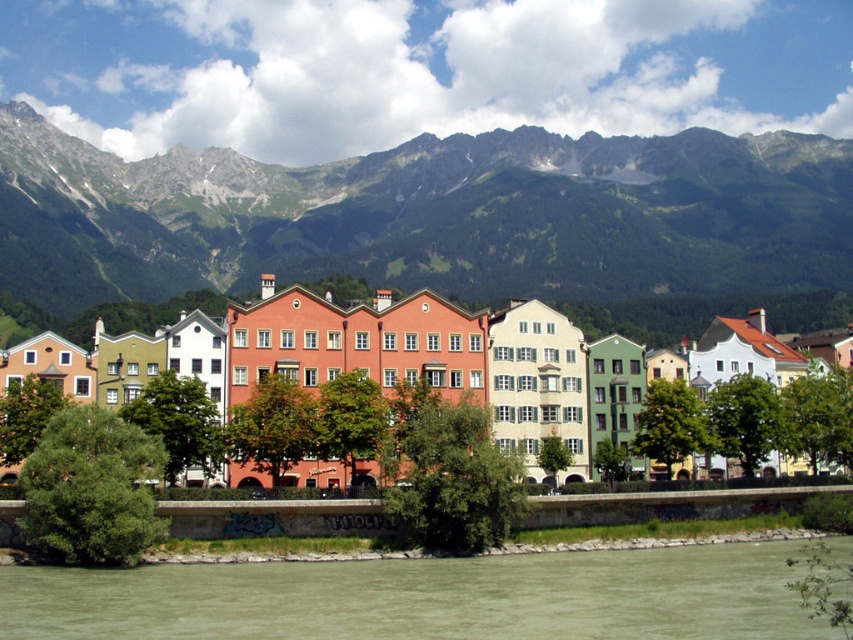
Which is more to the left, green rocky mountains at upper center or greenish-brown water at lower center?

Positioned to the left is greenish-brown water at lower center.

Is green rocky mountains at upper center further to camera compared to greenish-brown water at lower center?

Yes.

You are a GUI agent. You are given a task and a screenshot of the screen. Output one action in this format:
    pyautogui.click(x=<x>, y=<y>)
    Task: Click on the green rocky mountains at upper center
    This screenshot has height=640, width=853.
    Given the screenshot: What is the action you would take?
    pyautogui.click(x=428, y=216)